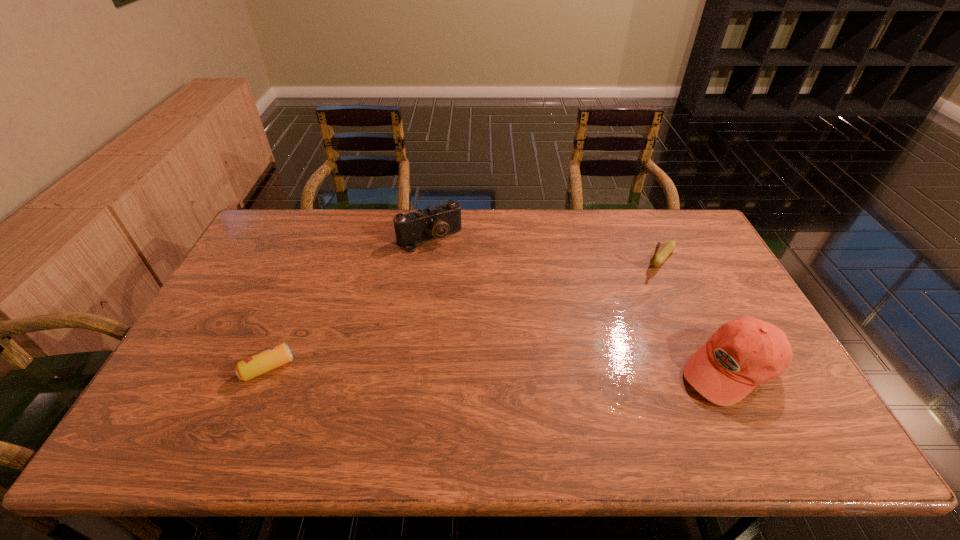
Locate an element on the screen. The height and width of the screenshot is (540, 960). free space located 0.220m at the stem of the banana is located at coordinates (620, 306).

Find the location of a particular element. The height and width of the screenshot is (540, 960). free spot located at the stem of the banana is located at coordinates (627, 298).

At what (x,y) coordinates should I click in order to perform the action: click on camera at the far edge. Please return your answer as a coordinate pair (x, y). The width and height of the screenshot is (960, 540). Looking at the image, I should click on (436, 221).

In order to click on banana located in the far edge section of the desktop in this screenshot , I will do `click(659, 257)`.

Find the location of a particular element. This screenshot has width=960, height=540. beer can at the near edge is located at coordinates 256,365.

The image size is (960, 540). I want to click on baseball cap present at the near edge, so click(745, 352).

Locate an element on the screen. baseball cap that is positioned at the right edge is located at coordinates (745, 352).

Find the location of a particular element. This screenshot has height=540, width=960. banana that is at the right edge is located at coordinates (659, 257).

Where is `object located in the far right corner section of the desktop`? This screenshot has width=960, height=540. object located in the far right corner section of the desktop is located at coordinates (659, 257).

The image size is (960, 540). I want to click on object present at the near right corner, so click(745, 352).